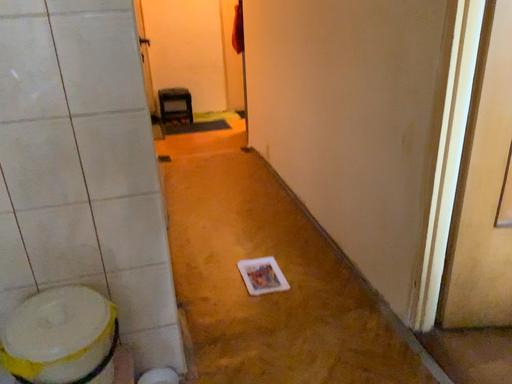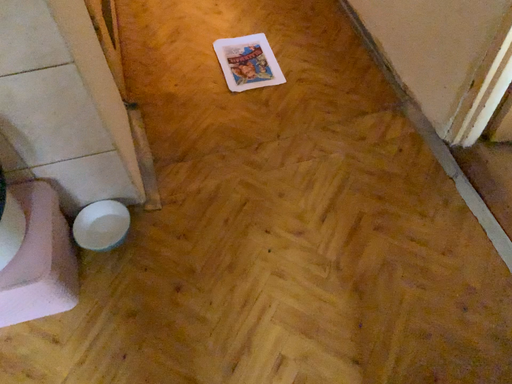
Question: Which way did the camera rotate in the video?

Choices:
 (A) rotated downward
 (B) rotated upward

Answer: (A)